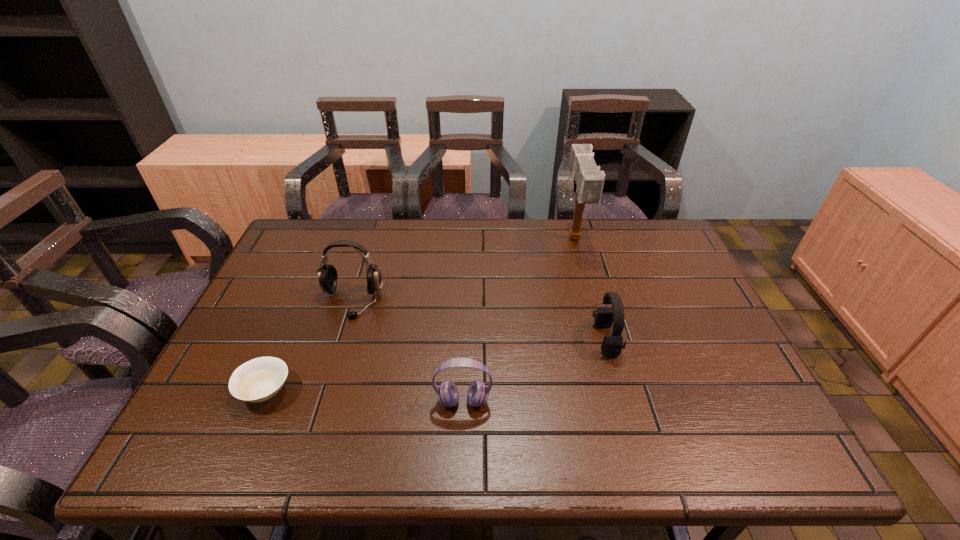
Where is `mallet`? The image size is (960, 540). mallet is located at coordinates (589, 180).

This screenshot has width=960, height=540. What are the coordinates of `the farthest object` in the screenshot? It's located at (589, 180).

Find the location of a particular element. This screenshot has width=960, height=540. the tallest headset is located at coordinates (327, 275).

This screenshot has width=960, height=540. Find the location of `the leftmost headset`. the leftmost headset is located at coordinates (327, 275).

Where is `the third object from left to right`? the third object from left to right is located at coordinates (447, 393).

Find the location of a particular element. the second headset from right to left is located at coordinates (447, 393).

Identify the location of the second nearest headset. (612, 344).

You are a GUI agent. You are given a task and a screenshot of the screen. Output one action in this format:
    pyautogui.click(x=<x>, y=<y>)
    Task: Click on the rightmost headset
    
    Given the screenshot: What is the action you would take?
    pyautogui.click(x=612, y=344)

Find the location of `the shortest object`. the shortest object is located at coordinates (259, 379).

At what (x,y) coordinates should I click in order to perform the action: click on vacant space located 0.210m on the left of the tallest object. Please return your answer as a coordinate pair (x, y). Looking at the image, I should click on [x=501, y=239].